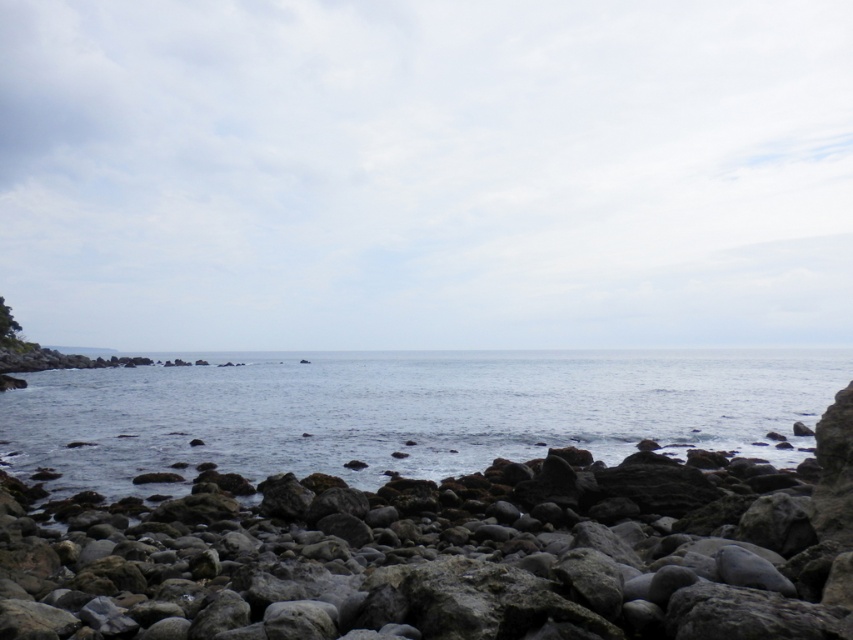
You are standing on the rocky shore and want to place a small seashell on the gray rock at center so it floats on the clear blue water at center. Is this possible?

The gray rock at center is located above clear blue water at center, so placing the seashell on the rock would cause it to rest on the rock, not float in the water. To make it float, you would need to place it directly in the water.

You are standing at the edge of the rocky shore and notice the gray rock at center and the clear blue water at center. From your perspective, which object is positioned to the right?

The gray rock at center is to the right of the clear blue water at center.